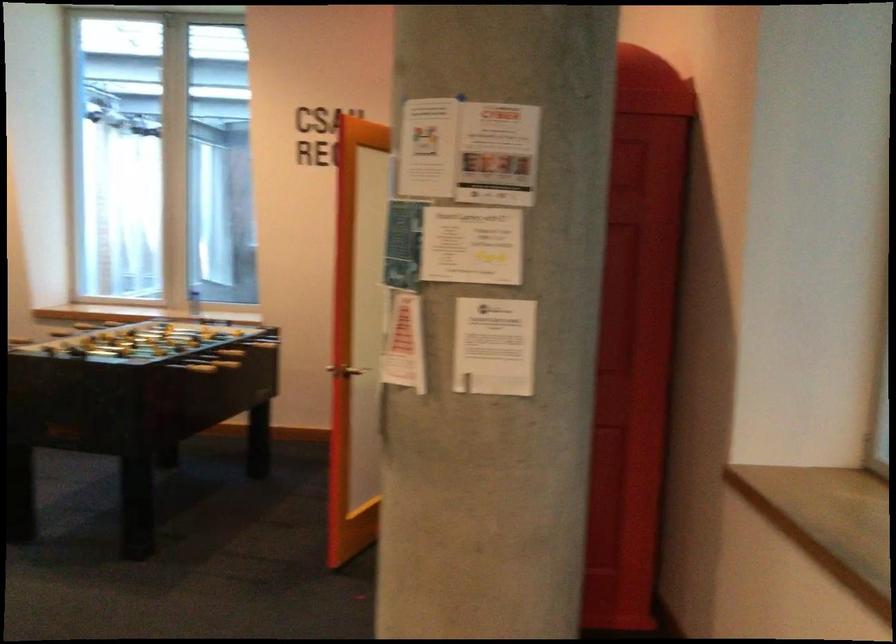
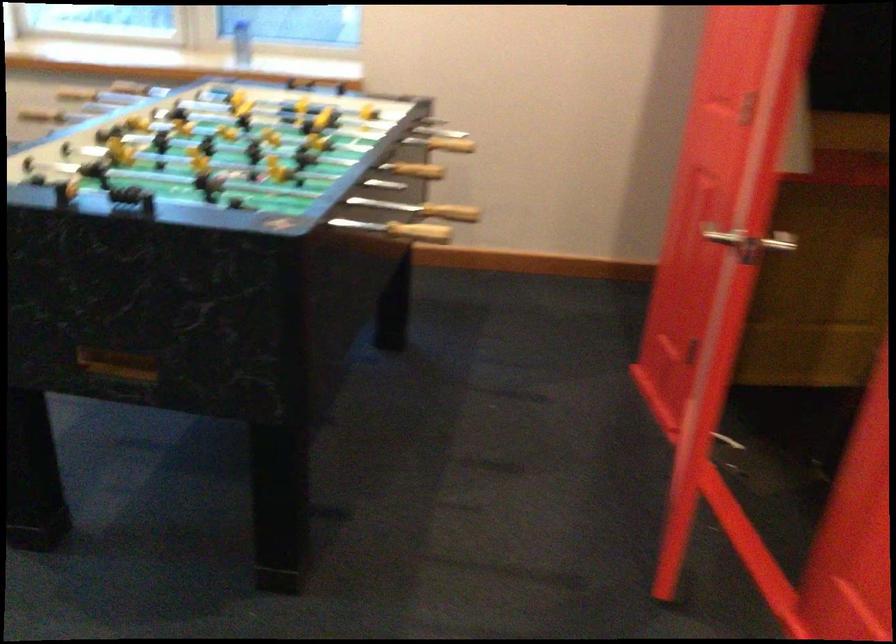
Which direction would the cameraman need to move to produce the second image?

The movement direction of the cameraman is left, forward.